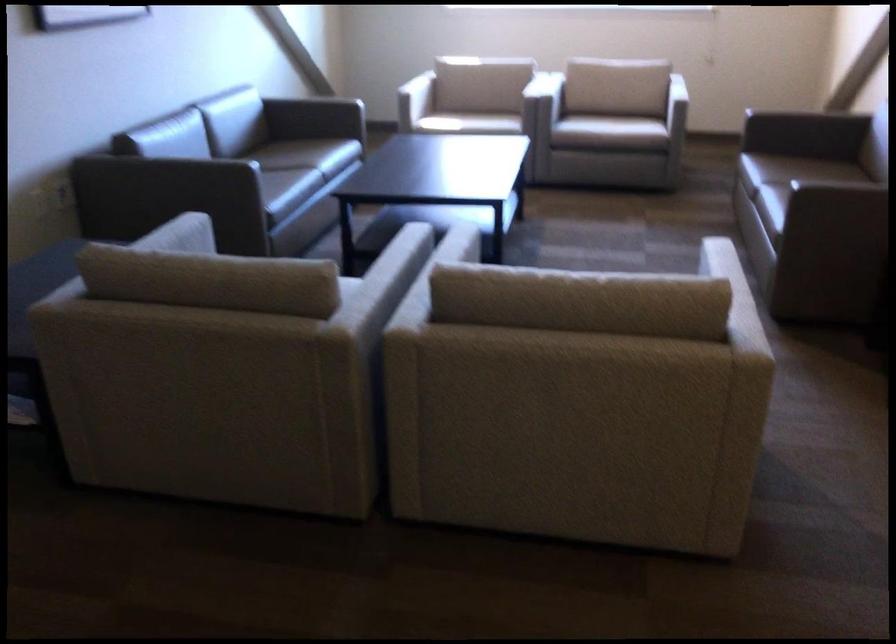
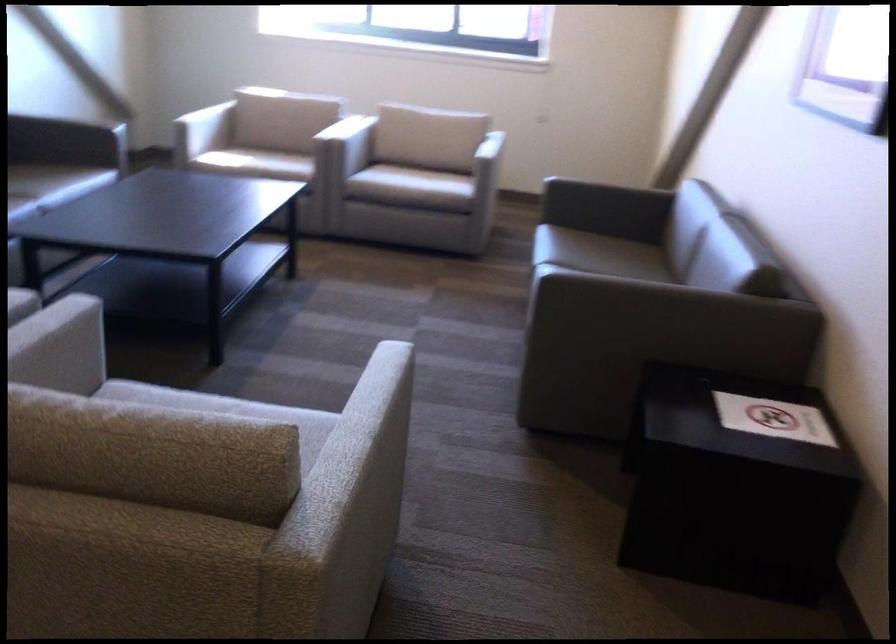
Locate, in the second image, the point that corresponds to [466,120] in the first image.

(255, 163)